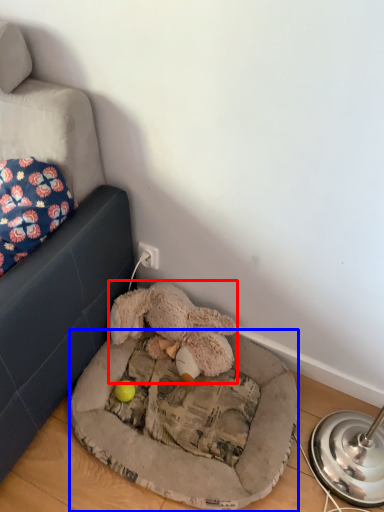
Question: Which of the following is the farthest to the observer, toy (highlighted by a red box) or dog bed (highlighted by a blue box)?

Choices:
 (A) toy
 (B) dog bed

Answer: (A)